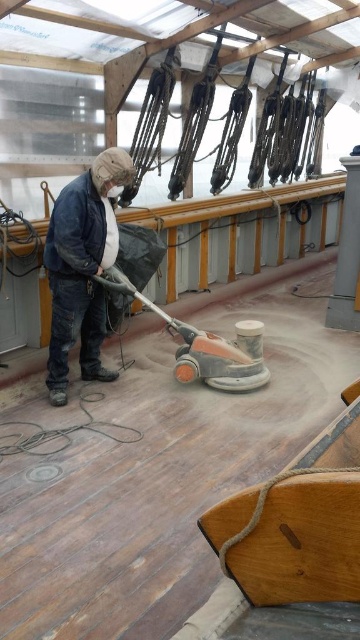
Question: Which of the following is the farthest from the observer?

Choices:
 (A) brown polished wood at center
 (B) matte blue jacket at center
 (C) orange rubber floor sander at center

Answer: (C)

Question: Can you confirm if brown polished wood at center is wider than matte blue jacket at center?

Choices:
 (A) no
 (B) yes

Answer: (B)

Question: Estimate the real-world distances between objects in this image. Which object is farther from the matte blue jacket at center?

Choices:
 (A) brown polished wood at center
 (B) orange rubber floor sander at center

Answer: (A)

Question: Can you confirm if brown polished wood at center is positioned to the left of orange rubber floor sander at center?

Choices:
 (A) no
 (B) yes

Answer: (B)

Question: Which point appears closest to the camera in this image?

Choices:
 (A) (137, 611)
 (B) (111, 193)
 (C) (208, 369)

Answer: (A)

Question: In this image, where is brown polished wood at center located relative to matte blue jacket at center?

Choices:
 (A) right
 (B) left

Answer: (A)